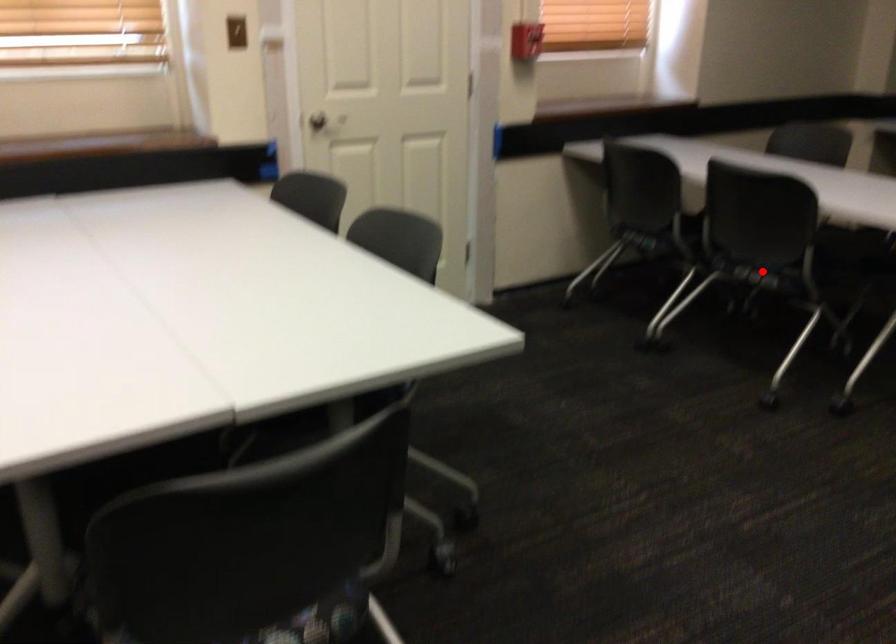
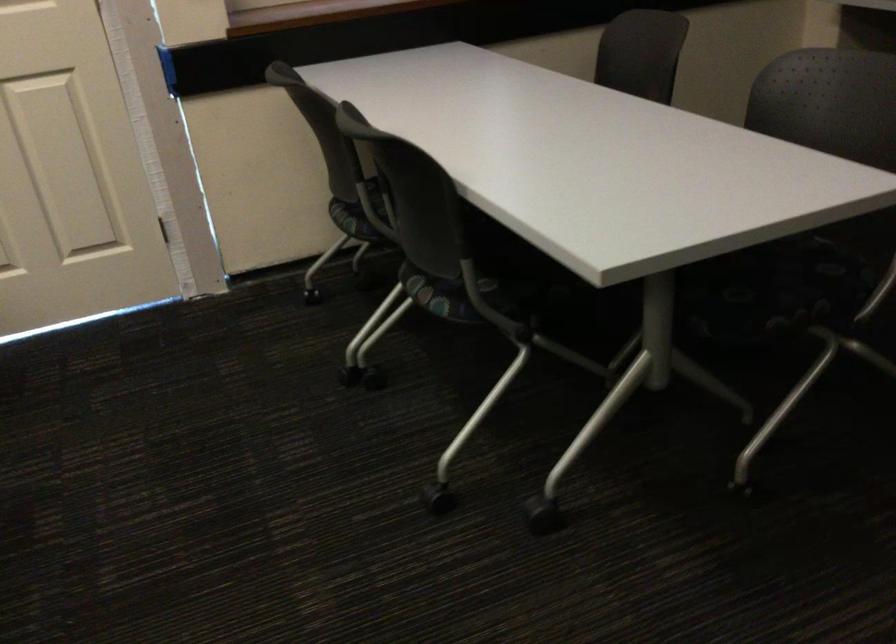
Locate, in the second image, the point that corresponds to the highlighted location in the first image.

(442, 295)